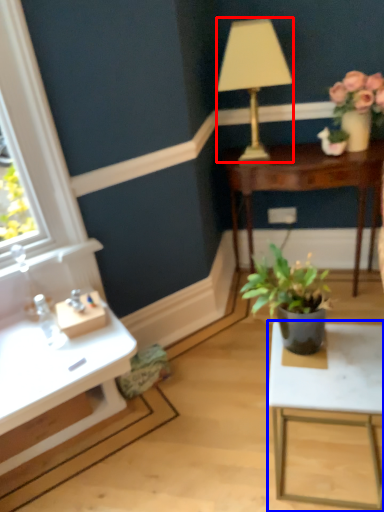
Question: Among these objects, which one is nearest to the camera, lamp (highlighted by a red box) or table (highlighted by a blue box)?

Choices:
 (A) lamp
 (B) table

Answer: (B)